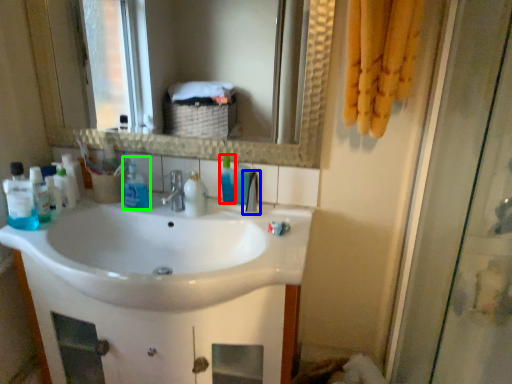
Question: Which object is positioned closest to cleaning product (highlighted by a red box)? Select from tap (highlighted by a blue box) and cleaning product (highlighted by a green box).

Choices:
 (A) tap
 (B) cleaning product

Answer: (A)